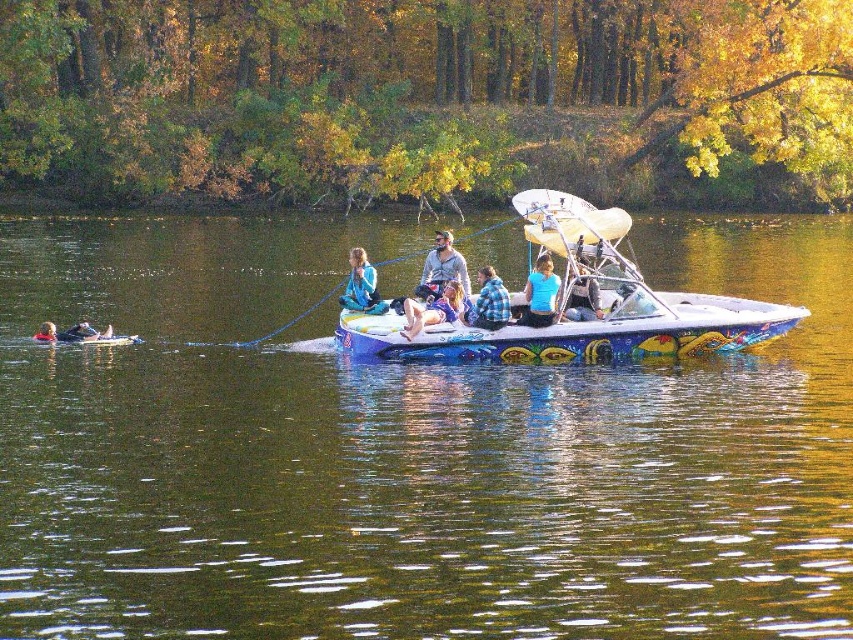
Is greenish water at center closer to the viewer compared to blue matte shirt at center?

Yes, greenish water at center is in front of blue matte shirt at center.

What do you see at coordinates (410, 451) in the screenshot? The width and height of the screenshot is (853, 640). I see `greenish water at center` at bounding box center [410, 451].

Between point (787, 300) and point (535, 314), which one is positioned behind?

The point (787, 300) is more distant.

This screenshot has width=853, height=640. In order to click on greenish water at center in this screenshot , I will do `click(410, 451)`.

Between greenish water at center and blue plaid shirt at center, which one is positioned lower?

blue plaid shirt at center is below.

Which is in front, point (48, 490) or point (497, 294)?

Positioned in front is point (48, 490).

Where is `greenish water at center`? greenish water at center is located at coordinates (410, 451).

Is blue denim shorts at center to the right of blue fabric jacket at center from the viewer's perspective?

Yes, blue denim shorts at center is to the right of blue fabric jacket at center.

Can you confirm if blue denim shorts at center is shorter than blue fabric jacket at center?

Yes, blue denim shorts at center is shorter than blue fabric jacket at center.

The height and width of the screenshot is (640, 853). I want to click on blue denim shorts at center, so click(433, 308).